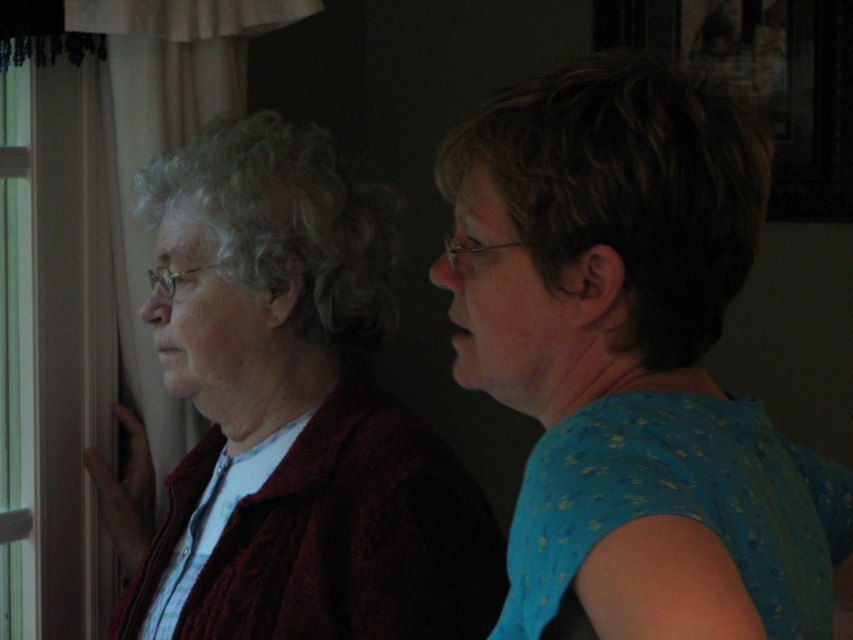
You are a delivery person standing at point (7, 131). You need to deliver a package to point (273, 620). Which direction should you move to reach the destination?

Point (273, 620) is in front of point (7, 131), so you should move forward to reach the destination.

You are a tailor trying to decide whether to place a new knitted maroon sweater at left on a mannequin next to the transparent glass window at left. Given that the window is 1.2 meters wide, can the sweater be displayed alongside it without overlapping?

The knitted maroon sweater at left has a larger size compared to the transparent glass window at left, so it might not fit next to the window without overlapping since the sweater is bigger than the window.

You are a delivery person who needs to place a small package between the blue dotted blouse at right and the knitted maroon sweater at left. The package is 40 centimeters long. Will it fit in the space between them?

The distance between the blue dotted blouse at right and the knitted maroon sweater at left is 45.64 centimeters. Since the package is 40 centimeters long, it will fit as there is enough space between them.